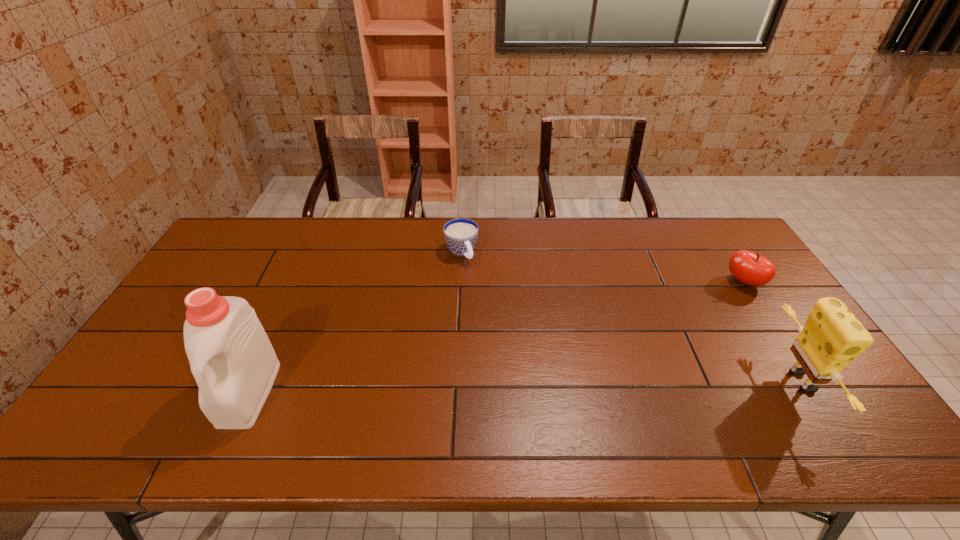
Locate an element on the screen. vacant space located 0.060m on the stem of the apple is located at coordinates (721, 296).

I want to click on free space located on the stem of the apple, so click(x=697, y=313).

The height and width of the screenshot is (540, 960). What are the coordinates of `vacant space located on the stem of the apple` in the screenshot? It's located at (675, 327).

At what (x,y) coordinates should I click in order to perform the action: click on object at the far edge. Please return your answer as a coordinate pair (x, y). The image size is (960, 540). Looking at the image, I should click on (460, 234).

Identify the location of detergent positioned at the near edge. The width and height of the screenshot is (960, 540). (231, 357).

Identify the location of sponge present at the near edge. The image size is (960, 540). (832, 337).

Where is `sponge situated at the right edge`? The height and width of the screenshot is (540, 960). sponge situated at the right edge is located at coordinates (832, 337).

Locate an element on the screen. The width and height of the screenshot is (960, 540). apple that is positioned at the right edge is located at coordinates (750, 268).

The height and width of the screenshot is (540, 960). I want to click on object that is at the near right corner, so click(x=832, y=337).

Find the location of a particular element. The height and width of the screenshot is (540, 960). vacant space at the far edge of the desktop is located at coordinates (525, 254).